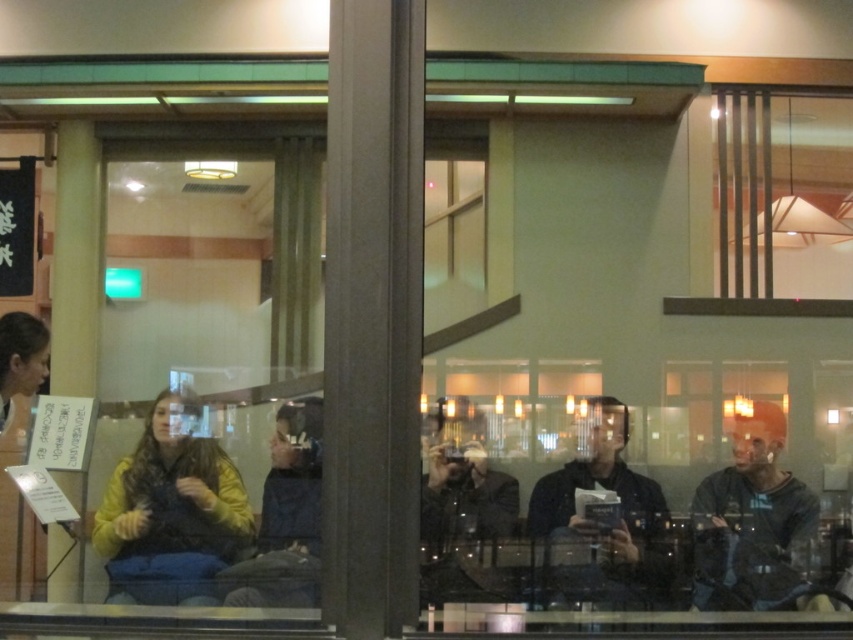
You are a photographer standing outside the window of a restaurant. You notice two people inside wearing the dark gray sweater at right and the denim jacket at center. Which clothing item is lower in position compared to the other?

The dark gray sweater at right is below denim jacket at center, so the dark gray sweater at right is lower in position than the denim jacket at center.

You are a photographer standing at the window. You want to capture both the yellow fleece sweater at lower left and the dark gray sweater at right in a single photo. The camera you are using has a maximum focus range of 2 meters. Can you fit both subjects into the frame without moving closer?

The distance between the yellow fleece sweater at lower left and the dark gray sweater at right is 2.26 meters. Since the camera can only focus up to 2 meters, the subjects are slightly out of range. You might need to adjust your position or use a different camera setting to capture both in focus.